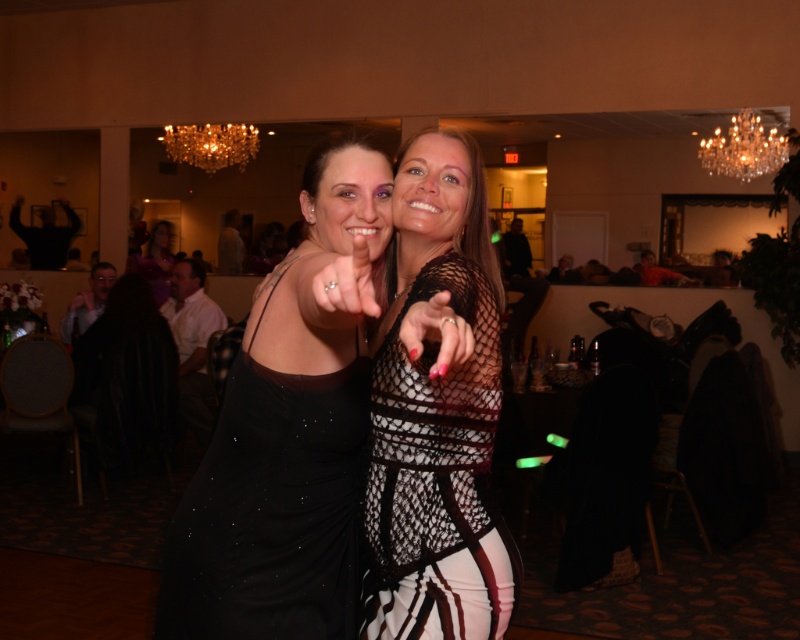
You are at a party and see a shiny object in the center of the room. There is a point marked at coordinates (350,282). What is the object located at this point?

The object located at point (350,282) is a matte black ring at center.

Looking at this image, you are a photographer taking a closeup shot of the hands in the image. You notice the matte black ring at center and the matte black nail at center. Which object is located to the left when looking at the hands?

The matte black ring at center is positioned on the left side of the matte black nail at center, so when looking at the hands, the matte black ring at center is to the left of the matte black nail at center.